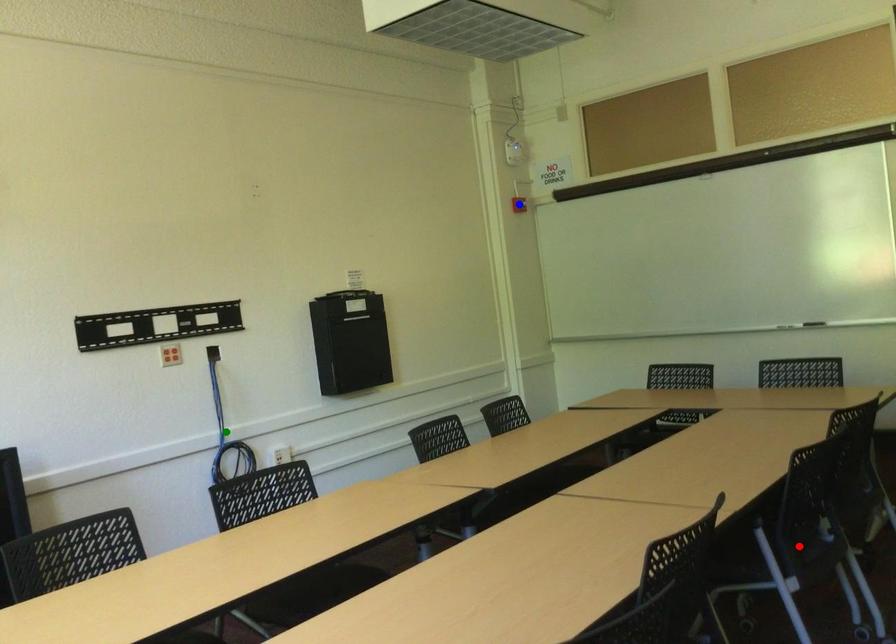
Order these from nearest to farthest:
- blue point
- red point
- green point

red point, green point, blue point